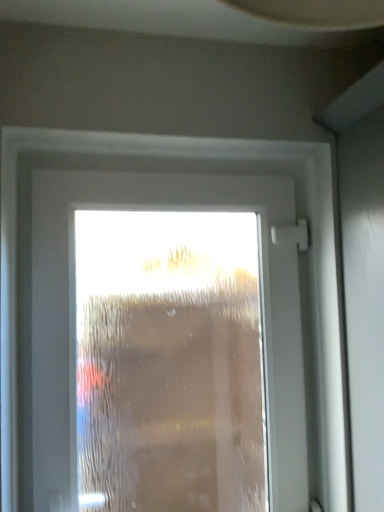
What are the coordinates of `transparent glass door at center` in the screenshot? It's located at point(74,312).

The image size is (384, 512). Describe the element at coordinates (74, 312) in the screenshot. I see `transparent glass door at center` at that location.

Measure the distance between transparent glass door at center and camera.

transparent glass door at center and camera are 3.53 feet apart from each other.

Where is `transparent glass door at center`? transparent glass door at center is located at coordinates (74, 312).